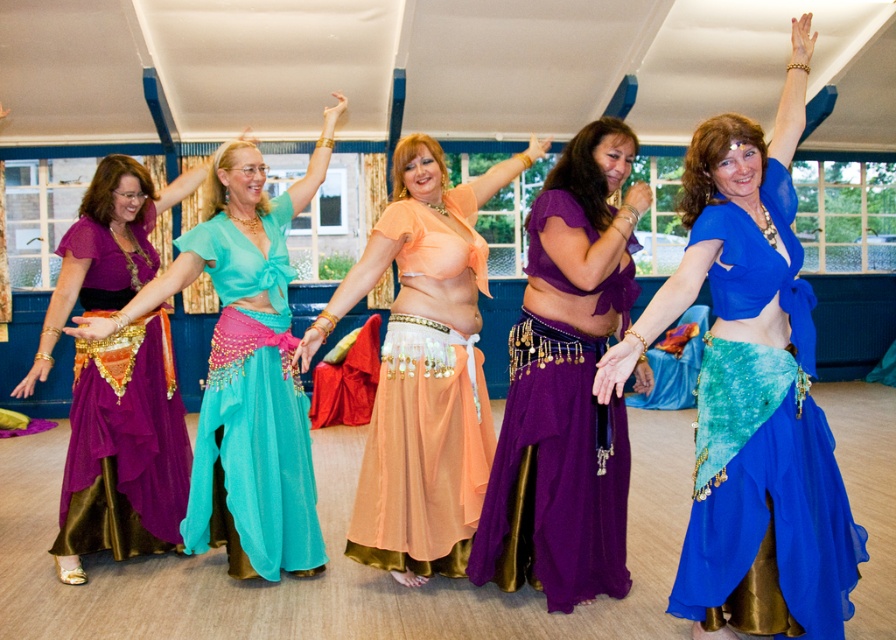
Does blue velvet skirt at center appear over shiny orange fabric at center?

No.

Looking at this image, is blue velvet skirt at center below shiny orange fabric at center?

Yes, blue velvet skirt at center is below shiny orange fabric at center.

I want to click on blue velvet skirt at center, so click(754, 392).

Between point (445, 508) and point (277, 488), which one is positioned in front?

Point (445, 508)

Does shiny orange fabric at center have a greater height compared to teal chiffon skirt at center?

Yes, shiny orange fabric at center is taller than teal chiffon skirt at center.

Who is more forward, [431,509] or [289,522]?

Positioned in front is point [431,509].

In order to click on shiny orange fabric at center in this screenshot , I will do `click(425, 368)`.

Does blue velvet skirt at center come behind purple satin skirt at center?

No, it is in front of purple satin skirt at center.

Does point (755, 202) come behind point (587, 416)?

No, it is not.

The height and width of the screenshot is (640, 896). I want to click on blue velvet skirt at center, so click(x=754, y=392).